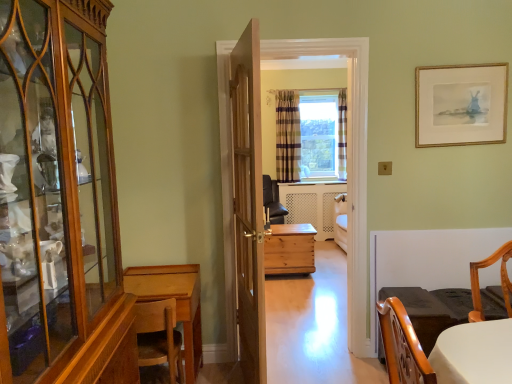
Question: From a real-world perspective, does wooden cabinet at left stand above wooden chest at center?

Choices:
 (A) no
 (B) yes

Answer: (B)

Question: Is wooden cabinet at left directly adjacent to wooden chest at center?

Choices:
 (A) no
 (B) yes

Answer: (A)

Question: Can you confirm if wooden cabinet at left is shorter than wooden chest at center?

Choices:
 (A) no
 (B) yes

Answer: (B)

Question: Is wooden cabinet at left positioned far away from wooden chest at center?

Choices:
 (A) yes
 (B) no

Answer: (B)

Question: Is wooden cabinet at left positioned with its back to wooden chest at center?

Choices:
 (A) yes
 (B) no

Answer: (B)

Question: From the image's perspective, is plaid fabric curtain at center, positioned as the second curtain in right-to-left order, above or below wooden door at center?

Choices:
 (A) above
 (B) below

Answer: (A)

Question: Visually, is plaid fabric curtain at center, positioned as the second curtain in right-to-left order, positioned to the left or to the right of wooden door at center?

Choices:
 (A) left
 (B) right

Answer: (B)

Question: Considering the positions of plaid fabric curtain at center, the first curtain viewed from the left, and wooden door at center in the image, is plaid fabric curtain at center, the first curtain viewed from the left, bigger or smaller than wooden door at center?

Choices:
 (A) big
 (B) small

Answer: (B)

Question: Does point (293, 150) appear closer or farther from the camera than point (261, 213)?

Choices:
 (A) farther
 (B) closer

Answer: (A)

Question: From their relative heights in the image, would you say plaid fabric curtain at center, which is counted as the 2th curtain, starting from the left, is taller or shorter than plaid fabric curtain at center, positioned as the second curtain in right-to-left order?

Choices:
 (A) tall
 (B) short

Answer: (A)

Question: Considering the positions of plaid fabric curtain at center, which is counted as the 2th curtain, starting from the left, and plaid fabric curtain at center, the first curtain viewed from the left, in the image, is plaid fabric curtain at center, which is counted as the 2th curtain, starting from the left, wider or thinner than plaid fabric curtain at center, the first curtain viewed from the left,?

Choices:
 (A) wide
 (B) thin

Answer: (B)

Question: Based on their sizes in the image, would you say plaid fabric curtain at center, which is counted as the 2th curtain, starting from the left, is bigger or smaller than plaid fabric curtain at center, positioned as the second curtain in right-to-left order?

Choices:
 (A) big
 (B) small

Answer: (B)

Question: From a real-world perspective, is plaid fabric curtain at center, placed as the 1th curtain when sorted from right to left, above or below plaid fabric curtain at center, positioned as the second curtain in right-to-left order?

Choices:
 (A) below
 (B) above

Answer: (B)

Question: Is plaid fabric curtain at center, positioned as the second curtain in right-to-left order, to the left or to the right of white glossy table at lower right in the image?

Choices:
 (A) left
 (B) right

Answer: (A)

Question: From the image's perspective, is plaid fabric curtain at center, the first curtain viewed from the left, positioned above or below white glossy table at lower right?

Choices:
 (A) below
 (B) above

Answer: (B)